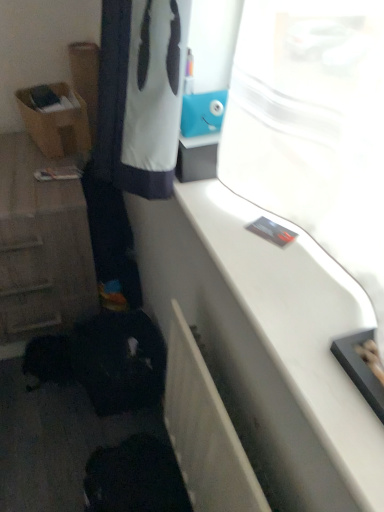
The width and height of the screenshot is (384, 512). What do you see at coordinates (57, 124) in the screenshot? I see `brown cardboard box at left` at bounding box center [57, 124].

What is the approximate width of white glossy counter top at upper right?

It is 8.62 inches.

I want to click on wooden cabinet at left, so pyautogui.click(x=41, y=245).

Where is `brown cardboard box at left`? The height and width of the screenshot is (512, 384). brown cardboard box at left is located at coordinates (57, 124).

From the image's perspective, is white glossy counter top at upper right located above brown cardboard box at left?

No, from the image's perspective, white glossy counter top at upper right is not over brown cardboard box at left.

Who is shorter, white glossy counter top at upper right or brown cardboard box at left?

white glossy counter top at upper right.

Which is more to the left, white glossy counter top at upper right or brown cardboard box at left?

Positioned to the left is brown cardboard box at left.

Is white glossy counter top at upper right far from brown cardboard box at left?

They are positioned close to each other.

Based on the photo, are wooden cabinet at left and brown cardboard box at left far apart?

No, there isn't a large distance between wooden cabinet at left and brown cardboard box at left.

Is wooden cabinet at left shorter than brown cardboard box at left?

In fact, wooden cabinet at left may be taller than brown cardboard box at left.

Is wooden cabinet at left to the right of brown cardboard box at left from the viewer's perspective?

No.

Is wooden cabinet at left looking in the opposite direction of white glossy counter top at upper right?

No, wooden cabinet at left is not facing away from white glossy counter top at upper right.

In the scene shown: Which is behind, wooden cabinet at left or white glossy counter top at upper right?

wooden cabinet at left is behind.

From a real-world perspective, is wooden cabinet at left above or below white glossy counter top at upper right?

wooden cabinet at left is situated lower than white glossy counter top at upper right in the real world.

Is point (4, 228) closer or farther from the camera than point (275, 339)?

Point (4, 228).

Between white glossy counter top at upper right and wooden cabinet at left, which one has larger size?

Bigger between the two is wooden cabinet at left.

Is point (303, 306) less distant than point (86, 248)?

Yes.

Is white glossy counter top at upper right at the right side of wooden cabinet at left?

Yes, white glossy counter top at upper right is to the right of wooden cabinet at left.

How many degrees apart are the facing directions of white glossy counter top at upper right and wooden cabinet at left?

The angular difference between white glossy counter top at upper right and wooden cabinet at left is 88.8 degrees.

Where is `counter top below the brown cardboard box at left (from the image's perspective)`? counter top below the brown cardboard box at left (from the image's perspective) is located at coordinates (298, 341).

Considering the sizes of objects brown cardboard box at left and white glossy counter top at upper right in the image provided, who is thinner, brown cardboard box at left or white glossy counter top at upper right?

Thinner between the two is brown cardboard box at left.

From the image's perspective, between brown cardboard box at left and white glossy counter top at upper right, who is located below?

white glossy counter top at upper right.

Which of these two, brown cardboard box at left or white glossy counter top at upper right, is bigger?

brown cardboard box at left is bigger.

Find the location of `cabinetry that appears in front of the brown cardboard box at left`. cabinetry that appears in front of the brown cardboard box at left is located at coordinates (41, 245).

From a real-world perspective, does brown cardboard box at left stand above wooden cabinet at left?

Correct, in the physical world, brown cardboard box at left is higher than wooden cabinet at left.

Does brown cardboard box at left have a smaller size compared to wooden cabinet at left?

Correct, brown cardboard box at left occupies less space than wooden cabinet at left.

Is the surface of brown cardboard box at left in direct contact with wooden cabinet at left?

No, brown cardboard box at left is not beside wooden cabinet at left.

This screenshot has width=384, height=512. What are the coordinates of `counter top that is above the brown cardboard box at left (from a real-world perspective)` in the screenshot? It's located at (298, 341).

Locate an element on the screen. This screenshot has height=512, width=384. cabinetry below the brown cardboard box at left (from the image's perspective) is located at coordinates (41, 245).

From the picture: Considering their positions, is brown cardboard box at left positioned further to white glossy counter top at upper right than wooden cabinet at left?

brown cardboard box at left is positioned further to the anchor white glossy counter top at upper right.

Based on their spatial positions, is white glossy counter top at upper right or wooden cabinet at left further from brown cardboard box at left?

Based on the image, white glossy counter top at upper right appears to be further to brown cardboard box at left.

Which object lies nearer to the anchor point white glossy counter top at upper right, wooden cabinet at left or brown cardboard box at left?

wooden cabinet at left.

Which object lies nearer to the anchor point wooden cabinet at left, brown cardboard box at left or white glossy counter top at upper right?

brown cardboard box at left.

Which object lies nearer to the anchor point brown cardboard box at left, wooden cabinet at left or white glossy counter top at upper right?

Based on the image, wooden cabinet at left appears to be nearer to brown cardboard box at left.

Looking at the image, which one is located closer to wooden cabinet at left, white glossy counter top at upper right or brown cardboard box at left?

brown cardboard box at left is positioned closer to the anchor wooden cabinet at left.

Find the location of `cabinetry between white glossy counter top at upper right and brown cardboard box at left from front to back`. cabinetry between white glossy counter top at upper right and brown cardboard box at left from front to back is located at coordinates (41, 245).